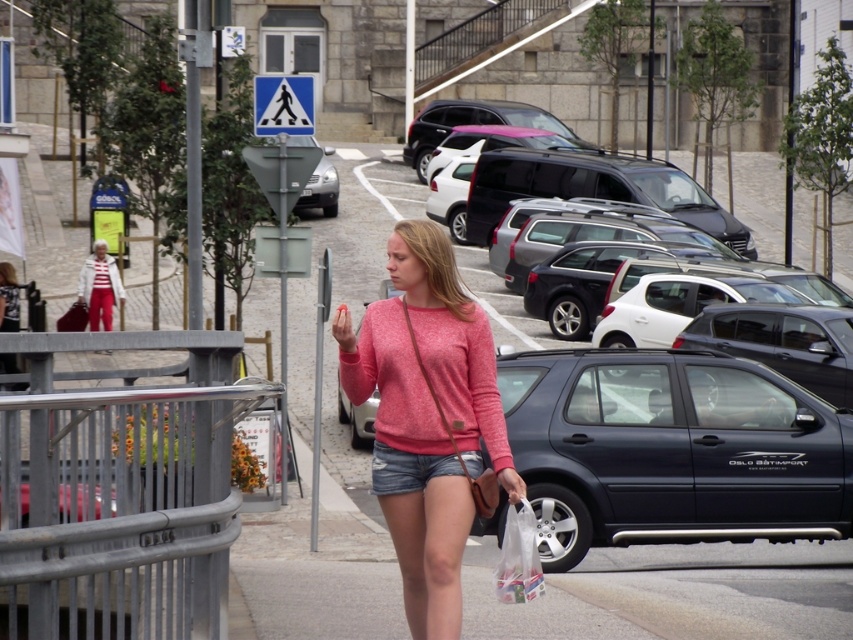
Can you confirm if matte black suv at center is positioned to the right of matte pink sweater at center?

Yes, matte black suv at center is to the right of matte pink sweater at center.

Who is positioned more to the left, matte black suv at center or matte pink sweater at center?

Positioned to the left is matte pink sweater at center.

Is point (514, 406) closer to viewer compared to point (381, 454)?

No, it is behind (381, 454).

In order to click on matte black suv at center in this screenshot , I will do `click(671, 451)`.

Between point (515, 397) and point (527, 545), which one is positioned in front?

Positioned in front is point (527, 545).

Between point (561, 515) and point (521, 592), which one is positioned behind?

Positioned behind is point (561, 515).

Does point (753, 525) come farther from viewer compared to point (537, 593)?

Yes.

Where is `matte black suv at center`? matte black suv at center is located at coordinates (671, 451).

Is matte pink sweater at center above translucent plastic bag at center?

Yes, matte pink sweater at center is above translucent plastic bag at center.

The image size is (853, 640). Describe the element at coordinates (428, 419) in the screenshot. I see `matte pink sweater at center` at that location.

Locate an element on the screen. The width and height of the screenshot is (853, 640). matte pink sweater at center is located at coordinates (428, 419).